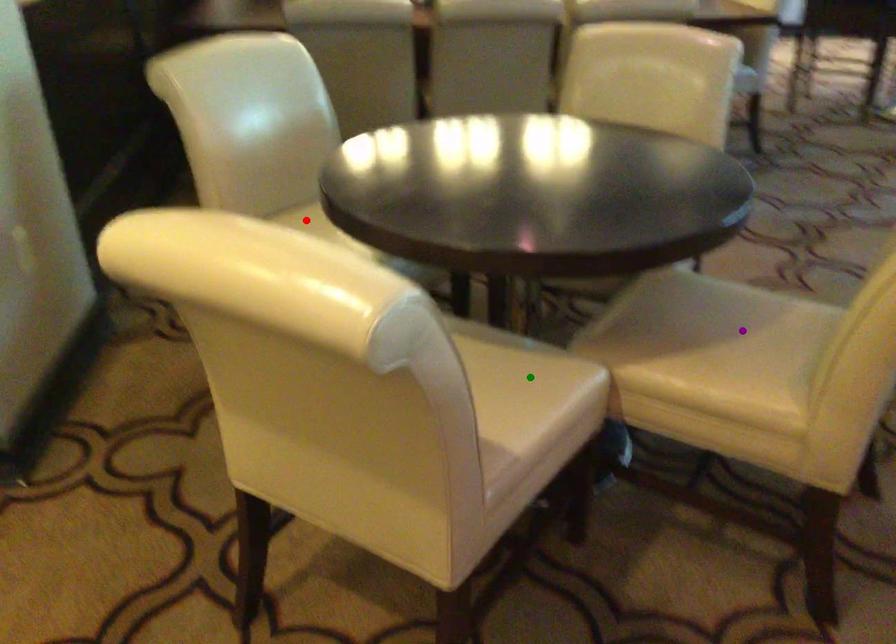
Order these from farthest to nearest:
1. purple point
2. green point
3. red point

red point < purple point < green point